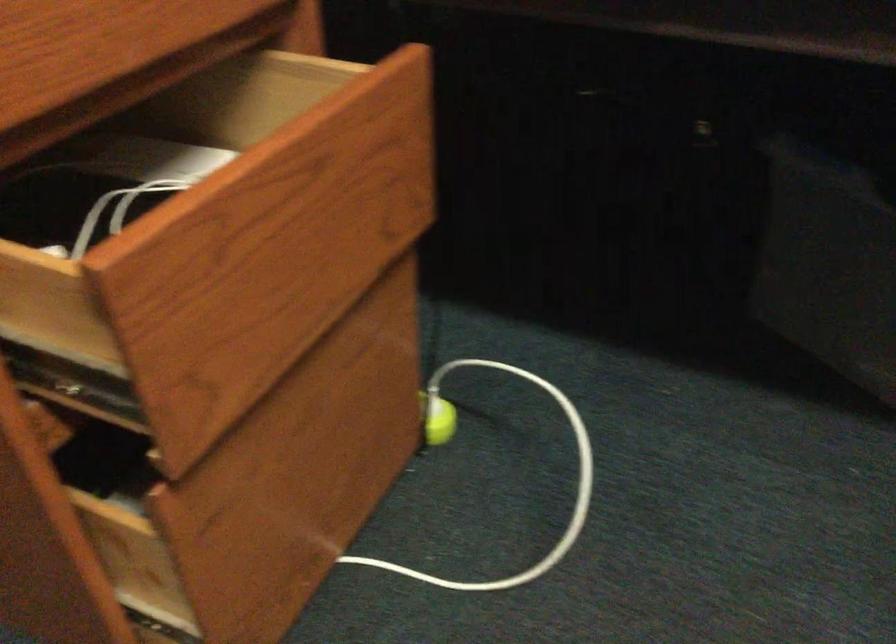
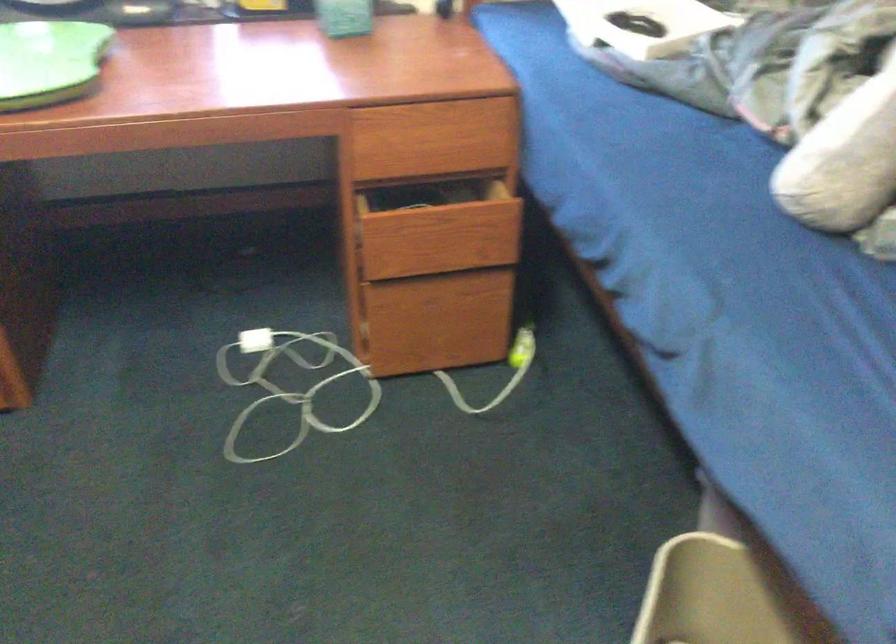
In the second image, find the point that corresponds to (x=330, y=260) in the first image.

(458, 242)